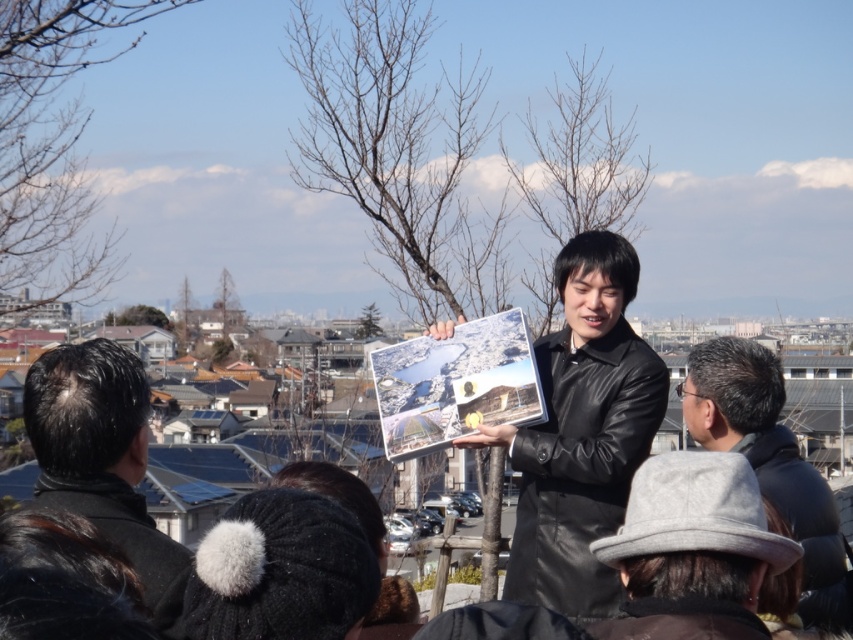
Consider the image. You are a photographer trying to capture a group photo. You notice the black matte hair at lower left and the gray woolen hat at lower right. Which object should you adjust to ensure both are visible in the frame?

The black matte hair at lower left has a lesser height compared to gray woolen hat at lower right. To ensure both are visible, you should adjust the angle so that the lower positioned black matte hair at lower left is raised or the taller gray woolen hat at lower right is lowered.